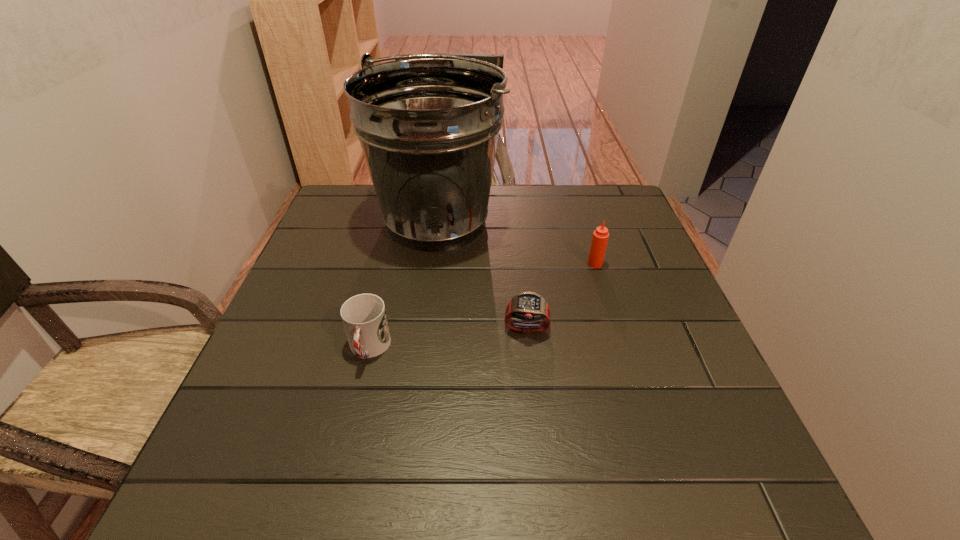
I want to click on unoccupied area between the shortest object and the second tallest object, so click(561, 296).

Identify the location of free space between the bucket and the second shortest object. pos(403,285).

Find the location of `vacant space that is in between the tallest object and the cup`. vacant space that is in between the tallest object and the cup is located at coordinates (403, 285).

You are a GUI agent. You are given a task and a screenshot of the screen. Output one action in this format:
    pyautogui.click(x=<x>, y=<y>)
    Task: Click on the unoccupied position between the Tabasco sauce and the third tallest object
    The width and height of the screenshot is (960, 540).
    Given the screenshot: What is the action you would take?
    pyautogui.click(x=482, y=306)

Where is `free spot between the tallest object and the second tallest object`? The image size is (960, 540). free spot between the tallest object and the second tallest object is located at coordinates (516, 243).

At what (x,y) coordinates should I click in order to perform the action: click on vacant space that's between the rightmost object and the cup. Please return your answer as a coordinate pair (x, y). The image size is (960, 540). Looking at the image, I should click on (482, 306).

The width and height of the screenshot is (960, 540). Identify the location of free spot between the watch and the cup. (447, 339).

At what (x,y) coordinates should I click in order to perform the action: click on free space between the bucket and the cup. Please return your answer as a coordinate pair (x, y). The image size is (960, 540). Looking at the image, I should click on pyautogui.click(x=403, y=285).

Identify which object is the second nearest to the cup. Please provide its 2D coordinates. Your answer should be formatted as a tuple, i.e. [(x, y)], where the tuple contains the x and y coordinates of a point satisfying the conditions above.

[(528, 306)]

Point out which object is positioned as the third nearest to the bucket. Please provide its 2D coordinates. Your answer should be formatted as a tuple, i.e. [(x, y)], where the tuple contains the x and y coordinates of a point satisfying the conditions above.

[(364, 318)]